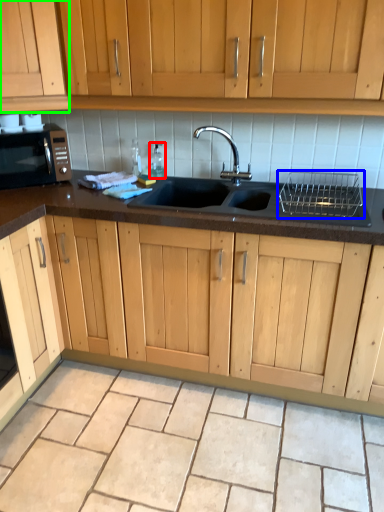
Question: Which is farther away from bottle (highlighted by a red box)? appliance (highlighted by a blue box) or cabinetry (highlighted by a green box)?

Choices:
 (A) appliance
 (B) cabinetry

Answer: (A)